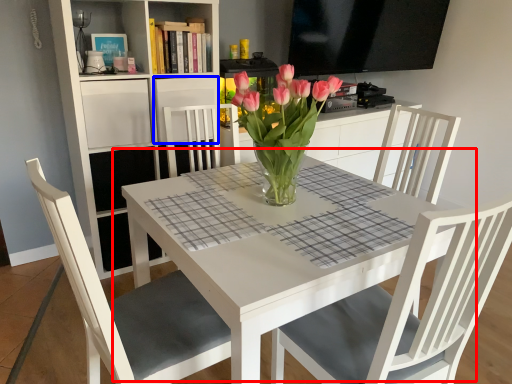
Question: Which of the following is the farthest to the observer, table (highlighted by a red box) or shelf (highlighted by a blue box)?

Choices:
 (A) table
 (B) shelf

Answer: (B)